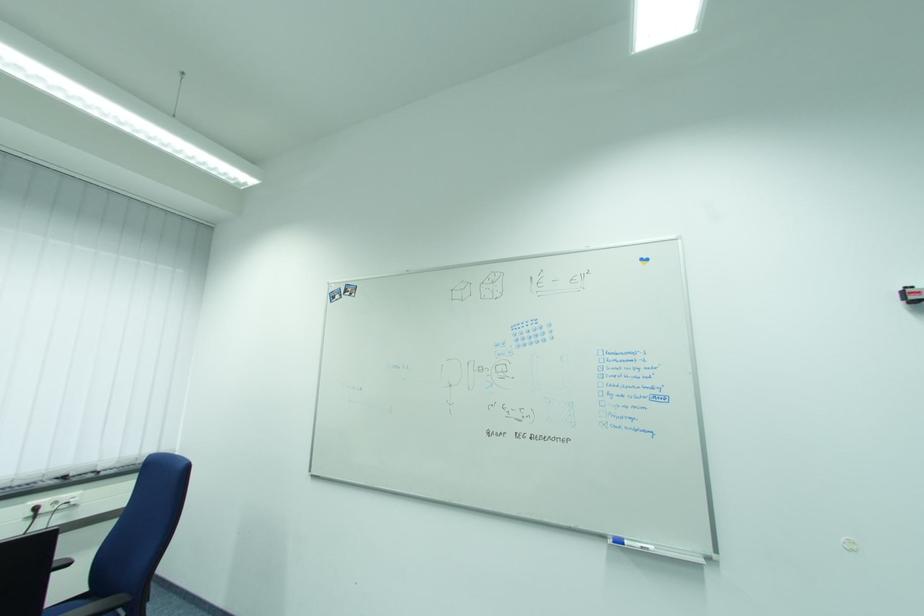
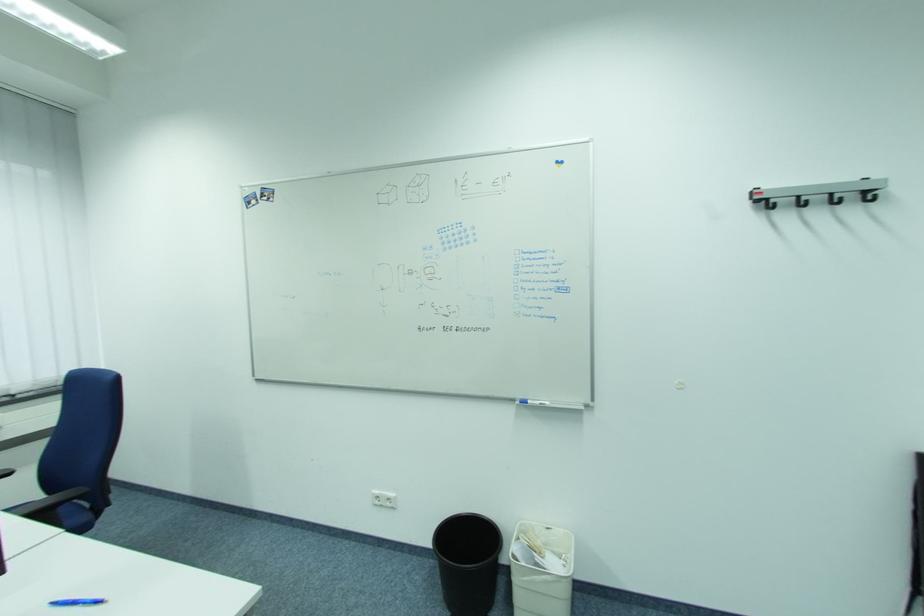
In a continuous first-person perspective shot, in which direction is the camera moving?

The cameraman moved toward right, backward.